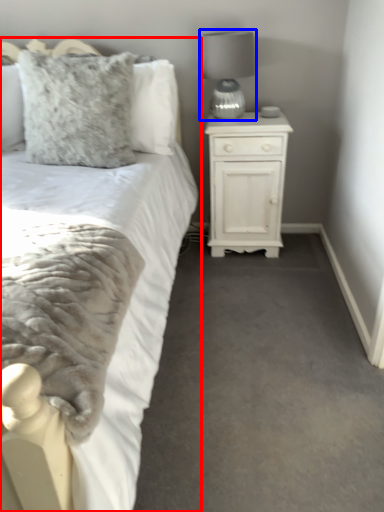
Question: Among these objects, which one is farthest to the camera, bed (highlighted by a red box) or lamp (highlighted by a blue box)?

Choices:
 (A) bed
 (B) lamp

Answer: (B)